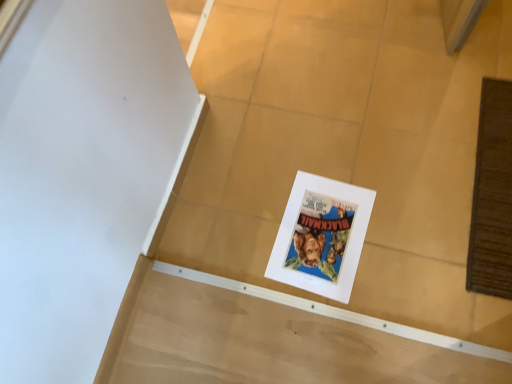
The height and width of the screenshot is (384, 512). What do you see at coordinates (321, 236) in the screenshot?
I see `matte paper poster at center` at bounding box center [321, 236].

Locate an element on the screen. The width and height of the screenshot is (512, 384). matte paper poster at center is located at coordinates (321, 236).

Identify the location of matte paper poster at center. (321, 236).